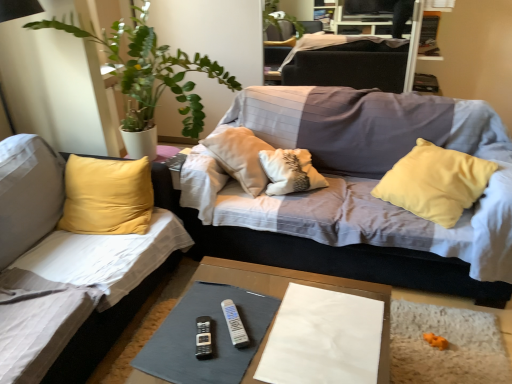
I want to click on vacant space in between black plastic remote at center, the 1th remote in the left-to-right sequence, and white paper at center, so click(249, 325).